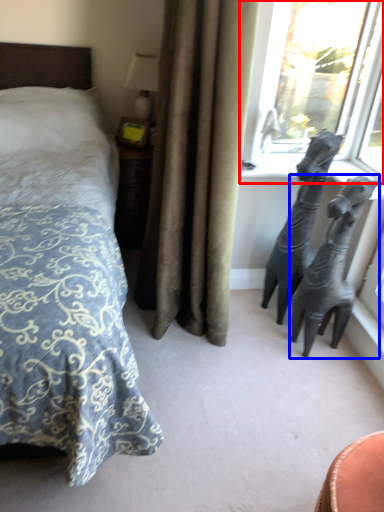
Question: Which object is further to the camera taking this photo, window (highlighted by a red box) or bronze sculpture (highlighted by a blue box)?

Choices:
 (A) window
 (B) bronze sculpture

Answer: (A)